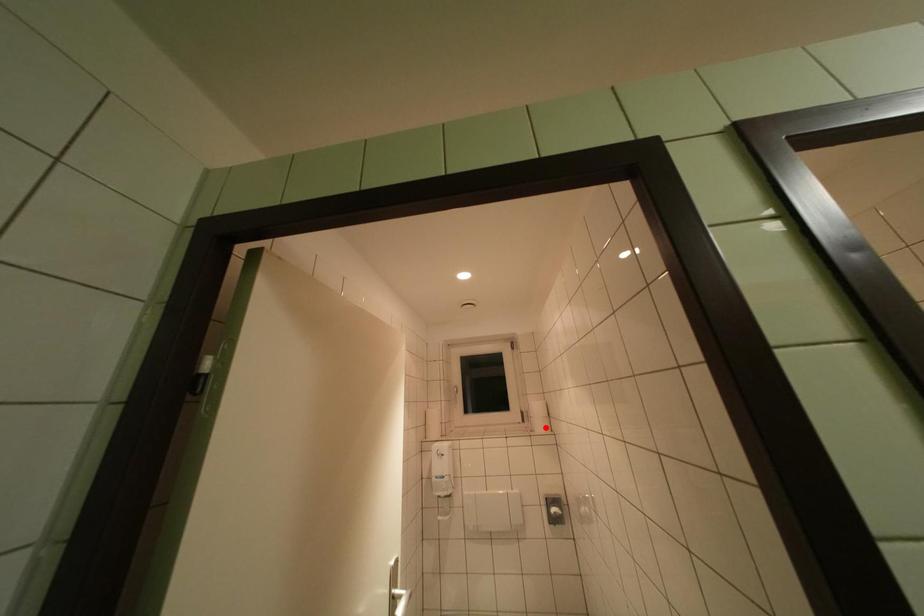
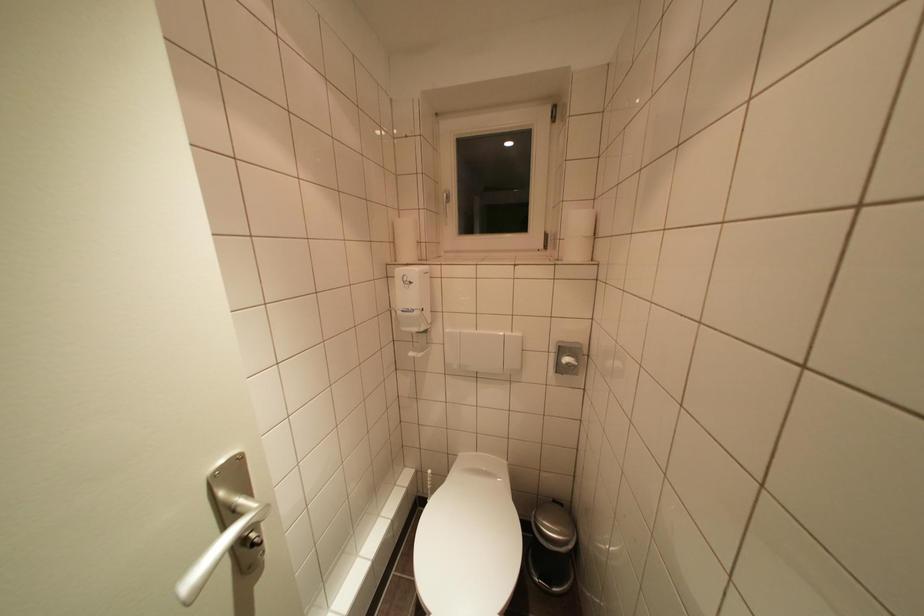
Find the pixel in the second image that matches the highlighted location in the first image.

(580, 252)